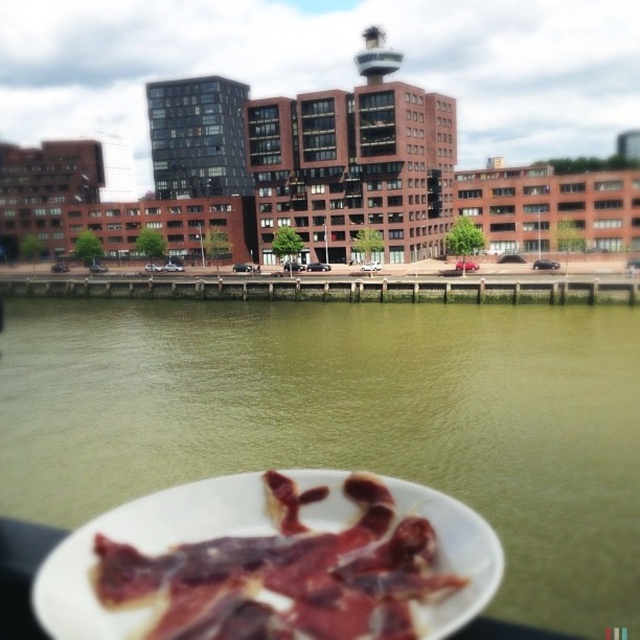
You are standing in the waterfront urban area and want to walk from point [634,422] to point [243,579]. Which direction should you move relative to your current position?

You should move forward because point [243,579] is closer to the viewer than point [634,422], so moving towards it would be forward.

Consider the image. You are standing at the center of the waterfront scene and want to place a small decorative statue exactly at the position of the greenish water at lower center. According to the coordinates provided, what are the coordinates where you should place the statue?

The coordinates for the greenish water at lower center are at point (348, 419), so you should place the statue at those coordinates.